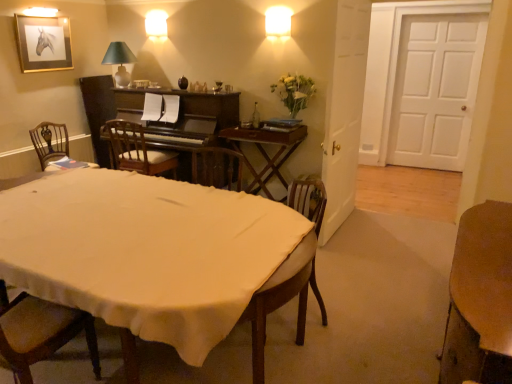
Image resolution: width=512 pixels, height=384 pixels. Describe the element at coordinates (255, 116) in the screenshot. I see `transparent glass bottle at center` at that location.

Where is `dark brown polished wood piano at center`? The width and height of the screenshot is (512, 384). dark brown polished wood piano at center is located at coordinates (181, 122).

Identify the location of wooden table at lower right, which is counted as the second table, starting from the back. (480, 299).

Describe the element at coordinates (265, 152) in the screenshot. I see `wooden desk at center, marked as the first table in a top-to-bottom arrangement` at that location.

Identify the location of wooden chair at center, arranged as the 3th chair when viewed from the front. (137, 150).

I want to click on white cloth-covered table at center, so click(x=150, y=254).

The image size is (512, 384). What do you see at coordinates (294, 92) in the screenshot?
I see `white matte vase at upper center` at bounding box center [294, 92].

Find the location of a particular element. The image size is (512, 384). transparent glass bottle at center is located at coordinates (255, 116).

Is white cloth-covered table at center taller or shorter than wooden chair at center, the 1th chair viewed from the back?

Considering their sizes, white cloth-covered table at center has less height than wooden chair at center, the 1th chair viewed from the back.

How many degrees apart are the facing directions of white cloth-covered table at center and wooden chair at center, arranged as the 3th chair when viewed from the front?

The angular difference between white cloth-covered table at center and wooden chair at center, arranged as the 3th chair when viewed from the front, is 178 degrees.

Considering the points (137, 230) and (163, 152), which point is behind, point (137, 230) or point (163, 152)?

The point (163, 152) is farther.

This screenshot has width=512, height=384. I want to click on desk in front of the wooden chair at center, arranged as the 3th chair when viewed from the front, so click(x=150, y=254).

Does wooden chair at center, the 1th chair viewed from the back, lie behind wooden chair at left, positioned as the 2th chair in front-to-back order?

Yes, it is behind wooden chair at left, positioned as the 2th chair in front-to-back order.

Is point (169, 166) more distant than point (54, 124)?

Yes, point (169, 166) is farther from viewer.

Can wooden chair at left, which is counted as the second chair, starting from the back, be found inside wooden chair at center, arranged as the 3th chair when viewed from the front?

No, wooden chair at center, arranged as the 3th chair when viewed from the front, does not contain wooden chair at left, which is counted as the second chair, starting from the back.

Which object is positioned more to the left, wooden chair at center, arranged as the 3th chair when viewed from the front, or transparent glass bottle at center?

wooden chair at center, arranged as the 3th chair when viewed from the front.

From the image's perspective, would you say wooden chair at center, arranged as the 3th chair when viewed from the front, is positioned over transparent glass bottle at center?

No.

Is wooden desk at center, marked as the first table in a top-to-bottom arrangement, positioned behind dark brown polished wood piano at center?

No, wooden desk at center, marked as the first table in a top-to-bottom arrangement, is closer to the viewer.

Is wooden desk at center, which is the second table in right-to-left order, taller than dark brown polished wood piano at center?

Incorrect, the height of wooden desk at center, which is the second table in right-to-left order, is not larger of that of dark brown polished wood piano at center.

What's the angular difference between wooden desk at center, arranged as the first table when viewed from the left, and dark brown polished wood piano at center's facing directions?

They differ by 1.19 degrees in their facing directions.

From a real-world perspective, is wooden desk at center, acting as the 2th table starting from the bottom, below dark brown polished wood piano at center?

Yes, from a real-world perspective, wooden desk at center, acting as the 2th table starting from the bottom, is below dark brown polished wood piano at center.

Considering the sizes of white cloth-covered table at center and wooden desk at center, acting as the 2th table starting from the bottom, in the image, is white cloth-covered table at center wider or thinner than wooden desk at center, acting as the 2th table starting from the bottom,?

In the image, white cloth-covered table at center appears to be wider than wooden desk at center, acting as the 2th table starting from the bottom.

Relative to wooden desk at center, positioned as the second table in front-to-back order, is white cloth-covered table at center in front or behind?

white cloth-covered table at center is positioned closer to the viewer than wooden desk at center, positioned as the second table in front-to-back order.

What's the angular difference between white cloth-covered table at center and wooden desk at center, positioned as the 1th table in back-to-front order,'s facing directions?

The facing directions of white cloth-covered table at center and wooden desk at center, positioned as the 1th table in back-to-front order, are 1.53 degrees apart.

In the scene shown: Is white cloth-covered table at center positioned beyond the bounds of wooden desk at center, marked as the first table in a top-to-bottom arrangement?

Yes, white cloth-covered table at center is outside of wooden desk at center, marked as the first table in a top-to-bottom arrangement.

Is point (97, 165) positioned behind point (286, 156)?

Yes, point (97, 165) is farther from viewer.

Can you tell me how much wooden chair at left, positioned as the 2th chair in front-to-back order, and wooden desk at center, which is the second table in right-to-left order, differ in facing direction?

The angle between the facing direction of wooden chair at left, positioned as the 2th chair in front-to-back order, and the facing direction of wooden desk at center, which is the second table in right-to-left order, is 89.6 degrees.

How much distance is there between wooden chair at left, positioned as the 2th chair in front-to-back order, and wooden desk at center, acting as the 2th table starting from the bottom?

wooden chair at left, positioned as the 2th chair in front-to-back order, and wooden desk at center, acting as the 2th table starting from the bottom, are 6.37 feet apart from each other.

From the image's perspective, which is above, wooden chair at left, positioned as the 2th chair in front-to-back order, or wooden desk at center, arranged as the first table when viewed from the left?

wooden chair at left, positioned as the 2th chair in front-to-back order, from the image's perspective.

Could you tell me if white matte door at right is turned towards wooden chair at left, positioned as the 2th chair in front-to-back order?

No, white matte door at right is not facing towards wooden chair at left, positioned as the 2th chair in front-to-back order.

Does white matte door at right have a greater height compared to wooden chair at left, which is counted as the second chair, starting from the back?

Correct, white matte door at right is much taller as wooden chair at left, which is counted as the second chair, starting from the back.

Is white matte door at right thinner than wooden chair at left, which is counted as the second chair, starting from the back?

Yes, white matte door at right is thinner than wooden chair at left, which is counted as the second chair, starting from the back.

What's the angular difference between white matte door at right and wooden chair at left, positioned as the 2th chair in front-to-back order,'s facing directions?

87.8 degrees separate the facing orientations of white matte door at right and wooden chair at left, positioned as the 2th chair in front-to-back order.

Where is `desk in front of the wooden chair at center, the 1th chair viewed from the back`? This screenshot has height=384, width=512. desk in front of the wooden chair at center, the 1th chair viewed from the back is located at coordinates (150, 254).

This screenshot has width=512, height=384. Identify the location of the 1st chair positioned below the wooden chair at center, arranged as the 3th chair when viewed from the front (from the image's perspective). (50, 142).

From the image, which object appears to be nearer to wooden chair at lower left, the third chair from the back, wooden chair at left, positioned as the 2th chair in front-to-back order, or wooden table at lower right, acting as the 1th table starting from the front?

wooden table at lower right, acting as the 1th table starting from the front, is closer to wooden chair at lower left, the third chair from the back.

Based on their spatial positions, is white matte door at right or white matte vase at upper center closer to wooden table at lower right, the 1th table positioned from the right?

white matte vase at upper center lies closer to wooden table at lower right, the 1th table positioned from the right, than the other object.

Estimate the real-world distances between objects in this image. Which object is further from wooden table at lower right, the first table from the bottom, white matte door at right or wooden chair at center, the 1th chair viewed from the back?

Based on the image, white matte door at right appears to be further to wooden table at lower right, the first table from the bottom.

When comparing their distances from wooden chair at lower left, which is counted as the 1th chair, starting from the front, does green fabric lampshade at upper left, placed as the 2th lamp when sorted from top to bottom, or wooden chair at left, which is counted as the second chair, starting from the back, seem further?

Among the two, green fabric lampshade at upper left, placed as the 2th lamp when sorted from top to bottom, is located further to wooden chair at lower left, which is counted as the 1th chair, starting from the front.

From the picture: Considering their positions, is white matte door at right positioned closer to white cloth-covered table at center than wooden chair at left, positioned as the 2th chair in front-to-back order?

wooden chair at left, positioned as the 2th chair in front-to-back order, lies closer to white cloth-covered table at center than the other object.

Estimate the real-world distances between objects in this image. Which object is further from wooden chair at center, arranged as the 3th chair when viewed from the front, wooden chair at lower left, the third chair from the back, or wooden chair at left, positioned as the 2th chair in front-to-back order?

Based on the image, wooden chair at lower left, the third chair from the back, appears to be further to wooden chair at center, arranged as the 3th chair when viewed from the front.

Which object lies further to the anchor point transparent glass bottle at center, green fabric lampshade at upper left, positioned as the first lamp in bottom-to-top order, or matte green lampshade at upper center, which appears as the 2th lamp when viewed from the left?

Among the two, green fabric lampshade at upper left, positioned as the first lamp in bottom-to-top order, is located further to transparent glass bottle at center.

Considering their positions, is white cloth-covered table at center positioned further to white matte door at right than green fabric lampshade at upper left, marked as the first lamp in a left-to-right arrangement?

Based on the image, white cloth-covered table at center appears to be further to white matte door at right.

The image size is (512, 384). I want to click on piano between gold-framed picture at upper left and transparent glass wine glass at upper center in the horizontal direction, so click(x=181, y=122).

Image resolution: width=512 pixels, height=384 pixels. In order to click on table between wooden chair at lower left, the third chair from the back, and matte green lampshade at upper center, acting as the 1th lamp starting from the right, in the front-back direction in this screenshot , I will do `click(265, 152)`.

Find the location of a particular element. The image size is (512, 384). wine glass between wooden chair at lower left, which is counted as the 1th chair, starting from the front, and matte green lampshade at upper center, the second lamp when ordered from bottom to top, in the front-back direction is located at coordinates (218, 86).

Find the location of a particular element. piano between white cloth-covered table at center and transparent glass wine glass at upper center in the front-back direction is located at coordinates (181, 122).